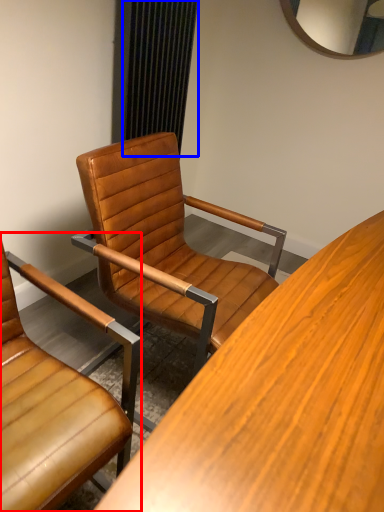
Question: Which point is closer to the camera, chair (highlighted by a red box) or curtain (highlighted by a blue box)?

Choices:
 (A) chair
 (B) curtain

Answer: (A)